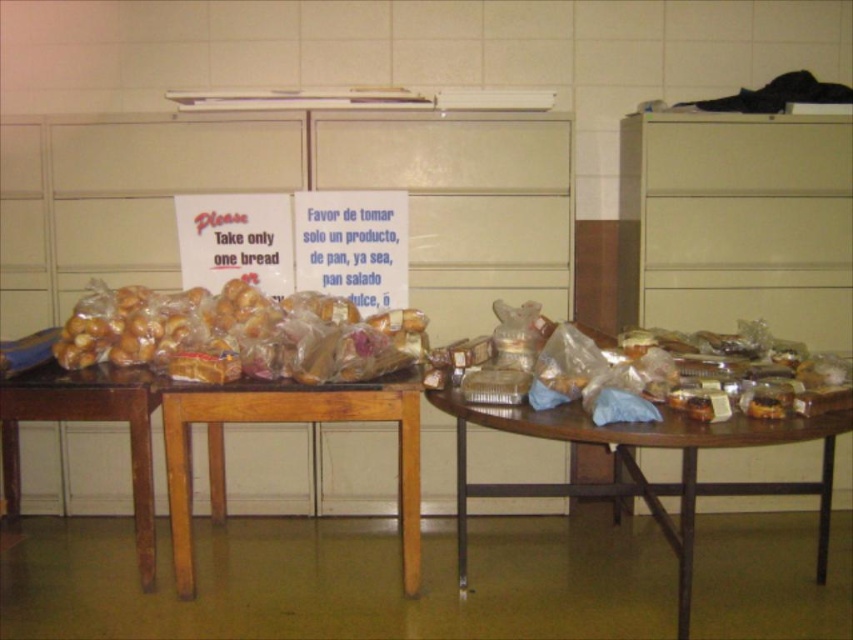
Image resolution: width=853 pixels, height=640 pixels. What do you see at coordinates (207, 440) in the screenshot?
I see `wooden table at left` at bounding box center [207, 440].

Which is behind, point (32, 404) or point (294, 353)?

Positioned behind is point (294, 353).

Image resolution: width=853 pixels, height=640 pixels. Find the location of `wooden table at left`. wooden table at left is located at coordinates (207, 440).

Who is positioned more to the left, wooden table at left or translucent plastic bag at center?

wooden table at left is more to the left.

Locate an element on the screen. Image resolution: width=853 pixels, height=640 pixels. wooden table at left is located at coordinates (207, 440).

Is the position of translucent plastic baguette at center more distant than that of translucent plastic bag at center?

Yes.

Is the position of translucent plastic baguette at center less distant than that of translucent plastic bag at center?

No, translucent plastic baguette at center is further to the viewer.

This screenshot has width=853, height=640. In order to click on translucent plastic baguette at center in this screenshot , I will do `click(236, 333)`.